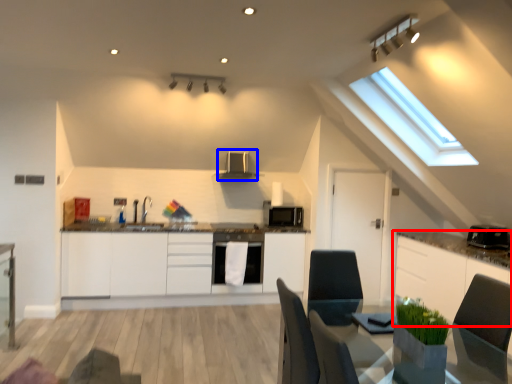
Question: Among these objects, which one is farthest to the camera, cabinetry (highlighted by a red box) or exhaust hood (highlighted by a blue box)?

Choices:
 (A) cabinetry
 (B) exhaust hood

Answer: (B)